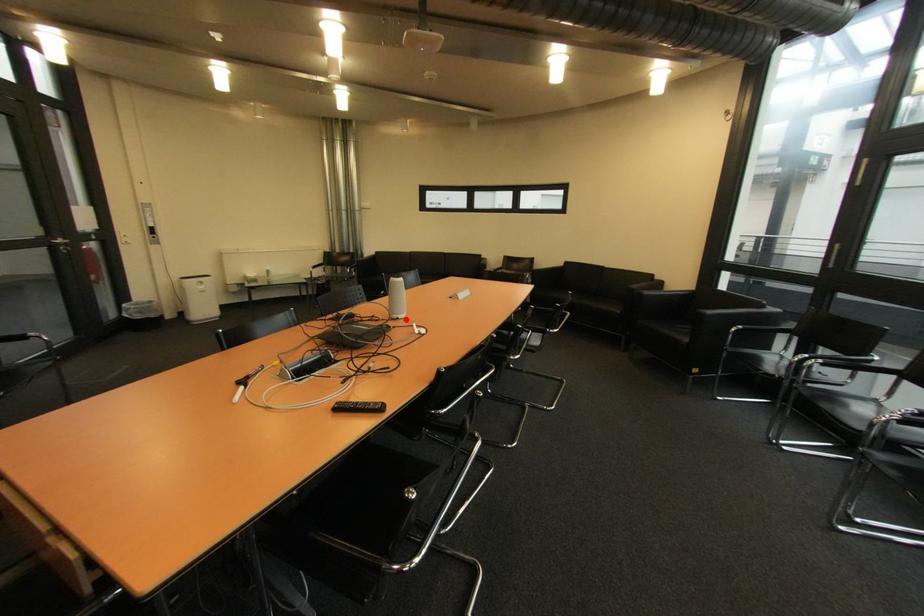
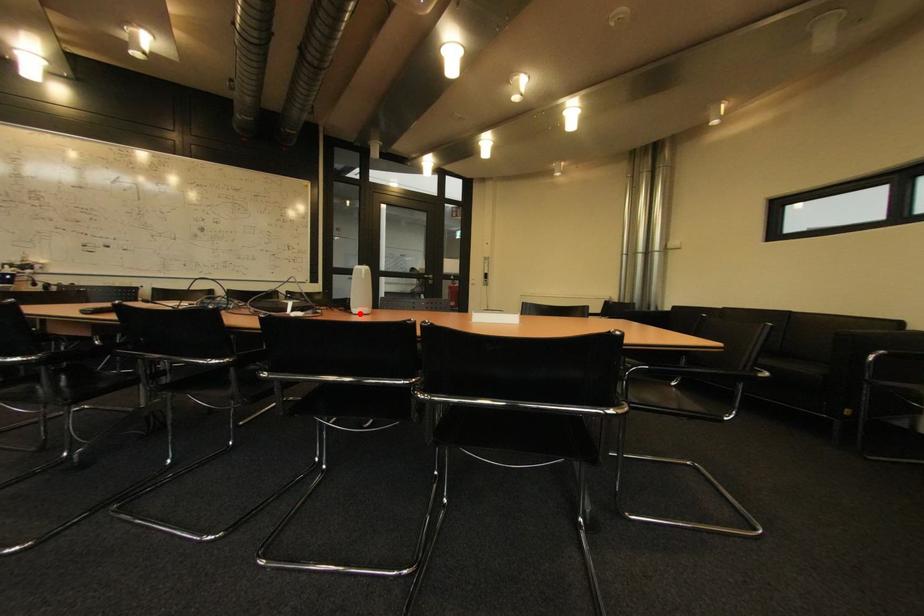
I am providing you with two images of the same scene from different viewpoints. A red point is marked on the first image and another point is marked on the second image. Do the highlighted points in image1 and image2 indicate the same real-world spot?

Yes